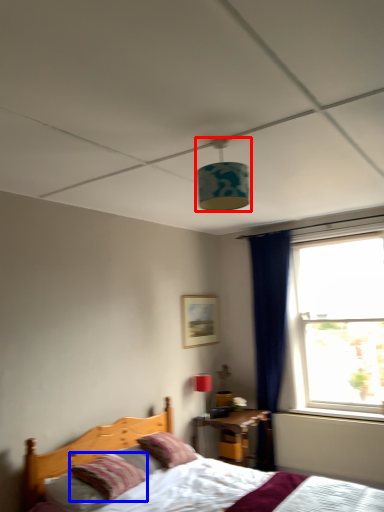
Question: Which object is closer to the camera taking this photo, lamp (highlighted by a red box) or pillow (highlighted by a blue box)?

Choices:
 (A) lamp
 (B) pillow

Answer: (A)